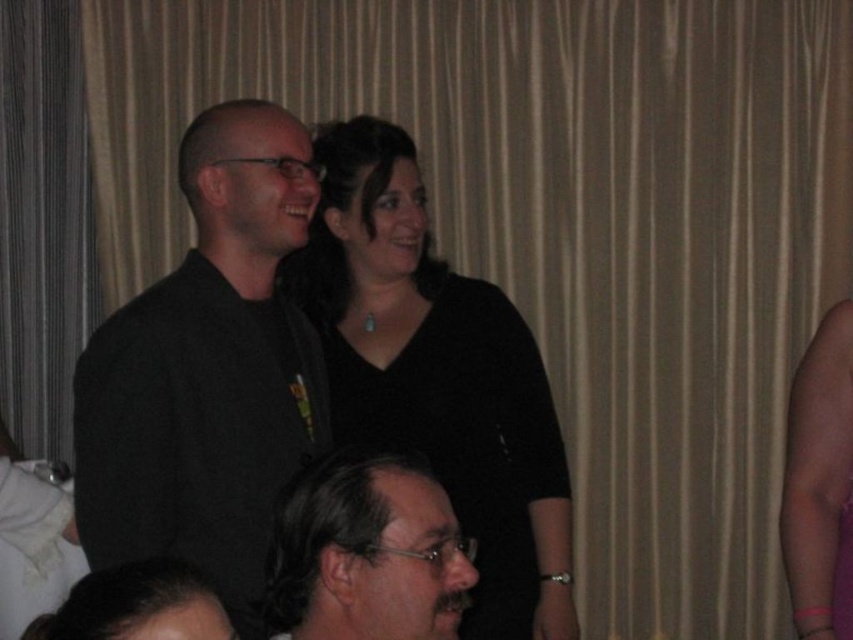
Question: Among these points, which one is farthest from the camera?

Choices:
 (A) (335, 592)
 (B) (524, 600)

Answer: (B)

Question: Can you confirm if black matte shirt at center is positioned above dark brown hair at lower center?

Choices:
 (A) yes
 (B) no

Answer: (A)

Question: Considering the real-world distances, which object is farthest from the dark brown hair at lower center?

Choices:
 (A) black matte shirt at left
 (B) black matte shirt at center

Answer: (B)

Question: From the image, what is the correct spatial relationship of black matte shirt at left in relation to dark brown hair at lower center?

Choices:
 (A) left
 (B) right

Answer: (A)

Question: Among these points, which one is farthest from the camera?

Choices:
 (A) (448, 284)
 (B) (265, 305)

Answer: (A)

Question: Is black matte shirt at left smaller than dark brown hair at lower center?

Choices:
 (A) no
 (B) yes

Answer: (A)